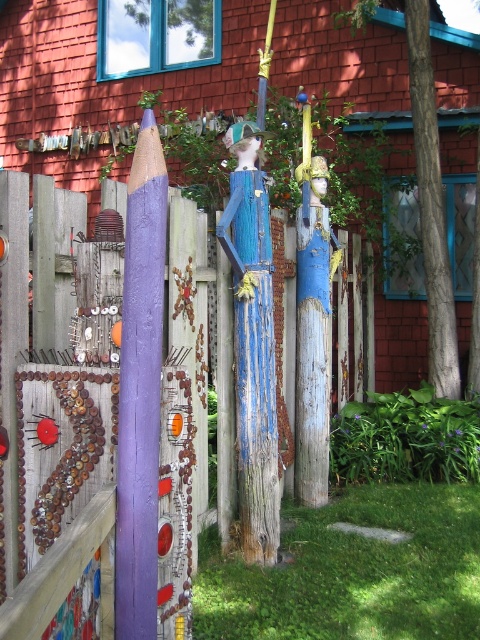
Question: Does wooden fence at center appear on the right side of purple painted wood at center?

Choices:
 (A) yes
 (B) no

Answer: (B)

Question: Is wooden fence at center wider than purple painted wood at center?

Choices:
 (A) yes
 (B) no

Answer: (A)

Question: Among these objects, which one is nearest to the camera?

Choices:
 (A) wooden fence at center
 (B) purple painted wood at center

Answer: (A)

Question: Can you confirm if wooden fence at center is positioned below purple painted wood at center?

Choices:
 (A) yes
 (B) no

Answer: (A)